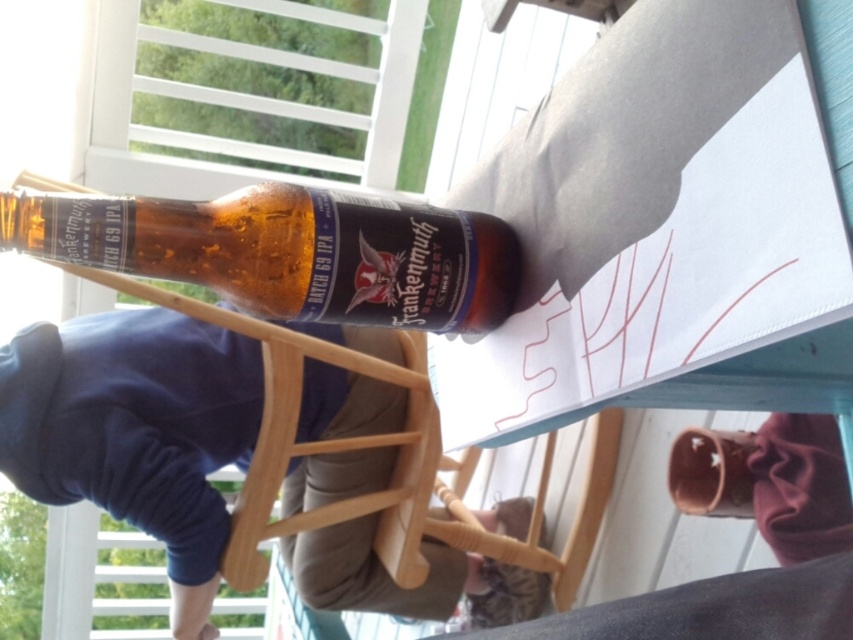
You are trying to place a small coaster under the translucent amber glass bottle at center to prevent condensation marks. Given that the coaster has a diameter of 10 cm, will it fit entirely under the bottle without overlapping the edges?

The translucent amber glass bottle at center is located at point (289, 252). Since the coaster has a diameter of 10 cm, it will fit under the bottle as long as the bottle itself does not exceed the coaster size. However, the description does not provide the bottle dimensions, so we cannot confirm. Please check the bottle size.